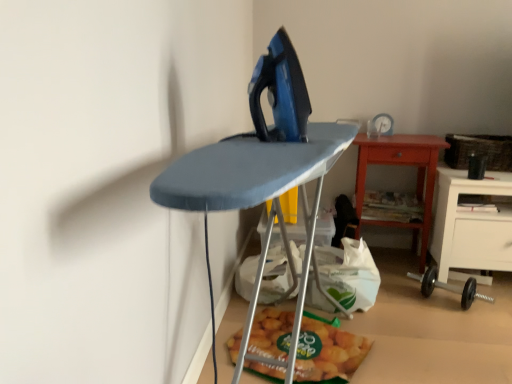
Describe the element at coordinates (403, 165) in the screenshot. This screenshot has height=384, width=512. I see `wooden table at center right` at that location.

The width and height of the screenshot is (512, 384). What do you see at coordinates (349, 274) in the screenshot? I see `white plastic grocery bag at lower center` at bounding box center [349, 274].

You are a GUI agent. You are given a task and a screenshot of the screen. Output one action in this format:
    pyautogui.click(x=<x>, y=<y>)
    Task: Click on the white plastic grocery bag at lower center
    This screenshot has width=512, height=384.
    Given the screenshot: What is the action you would take?
    pyautogui.click(x=349, y=274)

The width and height of the screenshot is (512, 384). What do you see at coordinates (252, 172) in the screenshot?
I see `blue fabric ironing board at center` at bounding box center [252, 172].

Image resolution: width=512 pixels, height=384 pixels. Identify the location of woven brown basket at right. (479, 151).

Can you confirm if woven brown basket at right is bigger than matte plastic bag of chips at lower center?

Correct, woven brown basket at right is larger in size than matte plastic bag of chips at lower center.

Can you see woven brown basket at right touching matte plastic bag of chips at lower center?

No, woven brown basket at right is not with matte plastic bag of chips at lower center.

Is woven brown basket at right taller than matte plastic bag of chips at lower center?

Indeed, woven brown basket at right has a greater height compared to matte plastic bag of chips at lower center.

Between woven brown basket at right and matte plastic bag of chips at lower center, which one is positioned behind?

woven brown basket at right is further from the camera.

Is blue fabric ironing board at center aimed at black rubber dumbbell at lower right?

No, blue fabric ironing board at center is not oriented towards black rubber dumbbell at lower right.

From the image's perspective, who appears lower, blue fabric ironing board at center or black rubber dumbbell at lower right?

black rubber dumbbell at lower right is shown below in the image.

Is blue fabric ironing board at center next to black rubber dumbbell at lower right?

No, blue fabric ironing board at center is not touching black rubber dumbbell at lower right.

Would you say blue fabric ironing board at center is outside black rubber dumbbell at lower right?

Yes, blue fabric ironing board at center is located beyond the bounds of black rubber dumbbell at lower right.

In terms of height, does matte plastic bag of chips at lower center look taller or shorter compared to wooden table at center right?

matte plastic bag of chips at lower center is shorter than wooden table at center right.

From a real-world perspective, between matte plastic bag of chips at lower center and wooden table at center right, who is vertically lower?

matte plastic bag of chips at lower center, from a real-world perspective.

From the image's perspective, does matte plastic bag of chips at lower center appear lower than wooden table at center right?

Indeed, from the image's perspective, matte plastic bag of chips at lower center is shown beneath wooden table at center right.

Is point (415, 157) closer or farther from the camera than point (206, 164)?

Point (415, 157).

In the scene shown: Considering the relative positions of wooden table at center right and blue fabric ironing board at center in the image provided, is wooden table at center right to the right of blue fabric ironing board at center from the viewer's perspective?

Indeed, wooden table at center right is positioned on the right side of blue fabric ironing board at center.

Does wooden table at center right have a greater height compared to blue fabric ironing board at center?

Incorrect, the height of wooden table at center right is not larger of that of blue fabric ironing board at center.

Is wooden table at center right wider than blue fabric ironing board at center?

Incorrect, the width of wooden table at center right does not surpass that of blue fabric ironing board at center.

Considering the positions of points (286, 151) and (361, 253), is point (286, 151) farther from camera compared to point (361, 253)?

No.

Can you confirm if blue fabric ironing board at center is positioned to the left of white plastic grocery bag at lower center?

Yes.

Is blue fabric ironing board at center facing away from white plastic grocery bag at lower center?

No, blue fabric ironing board at center's orientation is not away from white plastic grocery bag at lower center.

Identify the location of grocery bag below the blue fabric ironing board at center (from a real-world perspective). This screenshot has width=512, height=384. (349, 274).

Which is in front, point (416, 278) or point (362, 275)?

The point (362, 275) is closer.

Is black rubber dumbbell at lower right beside white plastic grocery bag at lower center?

black rubber dumbbell at lower right and white plastic grocery bag at lower center are clearly separated.

Considering the relative sizes of black rubber dumbbell at lower right and white plastic grocery bag at lower center in the image provided, is black rubber dumbbell at lower right smaller than white plastic grocery bag at lower center?

Correct, black rubber dumbbell at lower right occupies less space than white plastic grocery bag at lower center.

The image size is (512, 384). There is a black rubber dumbbell at lower right. Identify the location of grocery bag above it (from a real-world perspective). (349, 274).

From the image's perspective, is white plastic grocery bag at lower center on top of black rubber dumbbell at lower right?

Yes.

Is white plastic grocery bag at lower center located outside black rubber dumbbell at lower right?

Yes, white plastic grocery bag at lower center is outside of black rubber dumbbell at lower right.

Does point (365, 276) lie behind point (430, 271)?

No, (365, 276) is in front of (430, 271).

Image resolution: width=512 pixels, height=384 pixels. Identify the location of food that appears on the left of woven brown basket at right. (327, 352).

This screenshot has height=384, width=512. There is a black rubber dumbbell at lower right. What are the coordinates of `furniture above it (from a real-world perspective)` in the screenshot? It's located at (252, 172).

Which object lies further to the anchor point black rubber dumbbell at lower right, blue fabric ironing board at center or woven brown basket at right?

blue fabric ironing board at center lies further to black rubber dumbbell at lower right than the other object.

Looking at the image, which one is located closer to matte plastic bag of chips at lower center, woven brown basket at right or wooden table at center right?

The object closer to matte plastic bag of chips at lower center is wooden table at center right.

When comparing their distances from matte plastic bag of chips at lower center, does woven brown basket at right or blue fabric ironing board at center seem closer?

blue fabric ironing board at center lies closer to matte plastic bag of chips at lower center than the other object.

Looking at the image, which one is located closer to woven brown basket at right, black rubber dumbbell at lower right or white plastic grocery bag at lower center?

black rubber dumbbell at lower right.

From the image, which object appears to be farther from black rubber dumbbell at lower right, woven brown basket at right or blue fabric ironing board at center?

blue fabric ironing board at center lies further to black rubber dumbbell at lower right than the other object.

Based on their spatial positions, is black rubber dumbbell at lower right or blue fabric ironing board at center further from matte plastic bag of chips at lower center?

black rubber dumbbell at lower right is further to matte plastic bag of chips at lower center.

Considering their positions, is blue fabric ironing board at center positioned further to matte plastic bag of chips at lower center than woven brown basket at right?

woven brown basket at right is further to matte plastic bag of chips at lower center.

From the image, which object appears to be farther from matte plastic bag of chips at lower center, wooden table at center right or white plastic grocery bag at lower center?

wooden table at center right is positioned further to the anchor matte plastic bag of chips at lower center.

Where is `table between matte plastic bag of chips at lower center and black rubber dumbbell at lower right in the horizontal direction`? table between matte plastic bag of chips at lower center and black rubber dumbbell at lower right in the horizontal direction is located at coordinates (403, 165).

This screenshot has height=384, width=512. Find the location of `equipment situated between white plastic grocery bag at lower center and woven brown basket at right from left to right`. equipment situated between white plastic grocery bag at lower center and woven brown basket at right from left to right is located at coordinates (449, 287).

The width and height of the screenshot is (512, 384). In order to click on grocery bag between blue fabric ironing board at center and woven brown basket at right along the z-axis in this screenshot , I will do `click(349, 274)`.

Identify the location of table between matte plastic bag of chips at lower center and woven brown basket at right from left to right. (403, 165).